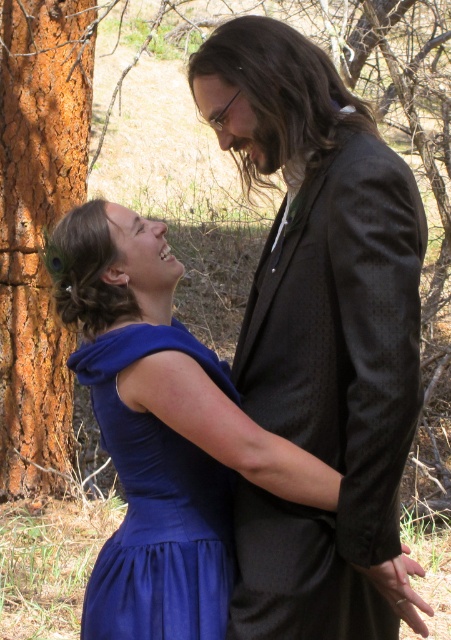
You are a photographer setting up a camera to capture the scene. The camera has a focus range that can only accommodate objects within a 20 cm size difference. Given the dark gray textured suit at center and the satin blue dress at center, will the camera be able to focus on both subjects simultaneously?

The dark gray textured suit at center is bigger than the satin blue dress at center. The size difference between them is not specified, but since the camera requires a 20 cm size difference to focus on both, and the description only states one is bigger without exact measurements, we cannot confirm if they fall within the 20 cm range. Therefore, it is uncertain if the camera can focus on both simultaneously.

You are planning to take a photo of the dark gray textured suit at center and the satin blue dress at center. Which clothing item should you focus on if you want to capture the wider one?

The dark gray textured suit at center might be wider than the satin blue dress at center, so you should focus on the dark gray textured suit at center to capture the wider one.

You are an observer standing in front of the dark gray textured suit at center and the orange rough bark tree at left. Which object is closer to you?

The dark gray textured suit at center is closer to you because it is in front of the orange rough bark tree at left.